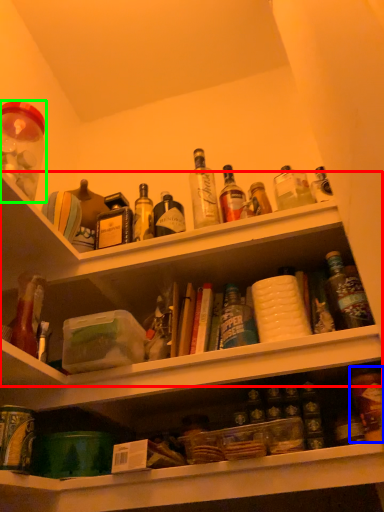
Question: Which object is positioned farthest from shelf (highlighted by a red box)? Select from bottle (highlighted by a blue box) and beverage (highlighted by a green box).

Choices:
 (A) bottle
 (B) beverage

Answer: (A)